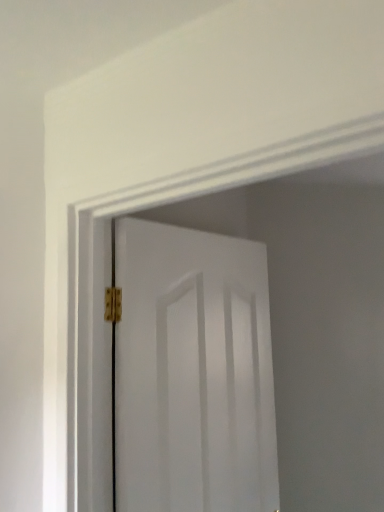
Where is `white matte door at center`? This screenshot has width=384, height=512. white matte door at center is located at coordinates (193, 372).

Image resolution: width=384 pixels, height=512 pixels. Describe the element at coordinates (193, 372) in the screenshot. I see `white matte door at center` at that location.

Find the location of a particular element. white matte door at center is located at coordinates (193, 372).